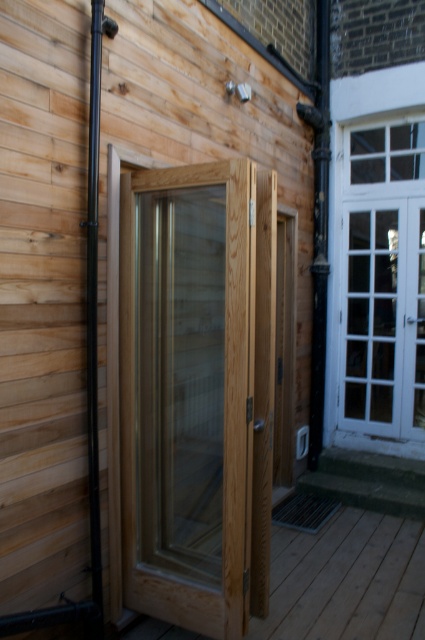
Can you confirm if natural wood door at center is positioned to the right of white glass door at upper right?

In fact, natural wood door at center is to the left of white glass door at upper right.

This screenshot has height=640, width=425. Identify the location of natural wood door at center. click(187, 392).

Between point (223, 529) and point (397, 292), which one is positioned in front?

Positioned in front is point (223, 529).

The image size is (425, 640). In order to click on natural wood door at center in this screenshot , I will do `click(187, 392)`.